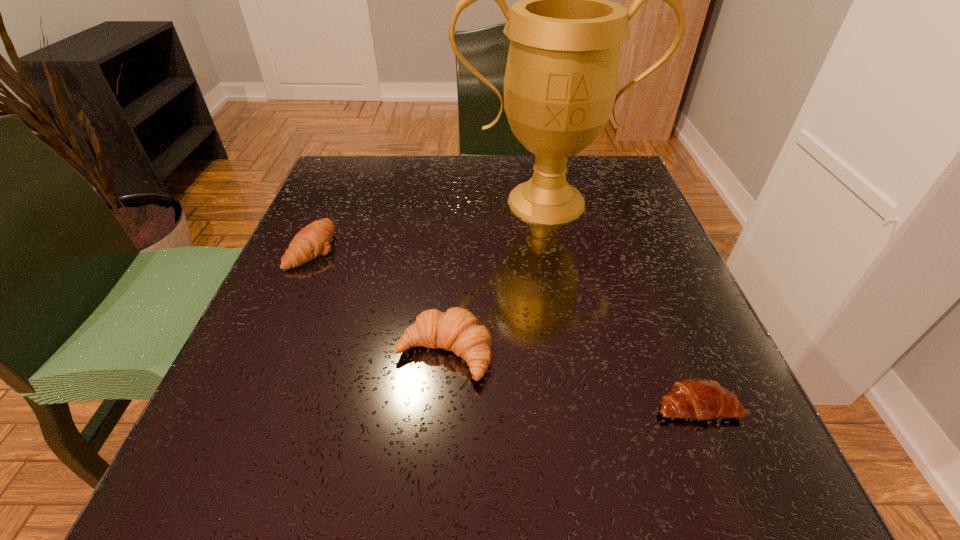
Find the location of a particular element. Image resolution: width=960 pixels, height=540 pixels. vacant region located on the back of the shortest object is located at coordinates (624, 225).

I want to click on object that is positioned at the far edge, so click(561, 80).

Find the location of a particular element. object at the left edge is located at coordinates (314, 239).

Locate an element on the screen. trophy present at the right edge is located at coordinates (561, 80).

The image size is (960, 540). I want to click on crescent roll that is at the right edge, so click(x=698, y=398).

This screenshot has height=540, width=960. In order to click on object that is at the far right corner in this screenshot , I will do `click(561, 80)`.

This screenshot has height=540, width=960. In order to click on free region at the far edge in this screenshot , I will do `click(483, 168)`.

Locate an element on the screen. vacant space at the near edge of the desktop is located at coordinates (445, 467).

Image resolution: width=960 pixels, height=540 pixels. In order to click on vacant space at the left edge of the desktop in this screenshot , I will do `click(288, 310)`.

This screenshot has width=960, height=540. In the image, there is a desktop. What are the coordinates of `vacant space at the right edge` in the screenshot? It's located at (640, 224).